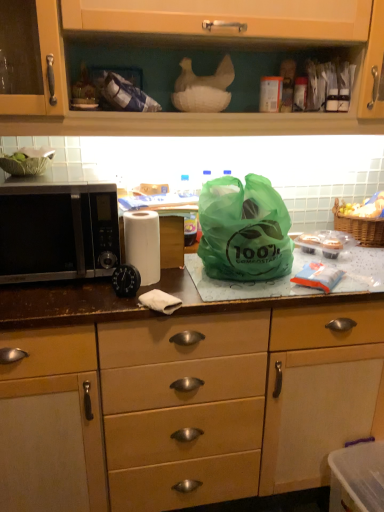
Locate an element on the screen. Image resolution: width=384 pixels, height=512 pixels. vacant region to the right of white matte paper towel at center is located at coordinates (186, 288).